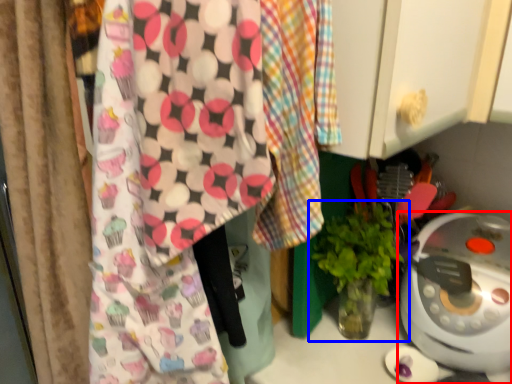
Question: Which point is further to the camera, home appliance (highlighted by a red box) or houseplant (highlighted by a blue box)?

Choices:
 (A) home appliance
 (B) houseplant

Answer: (B)